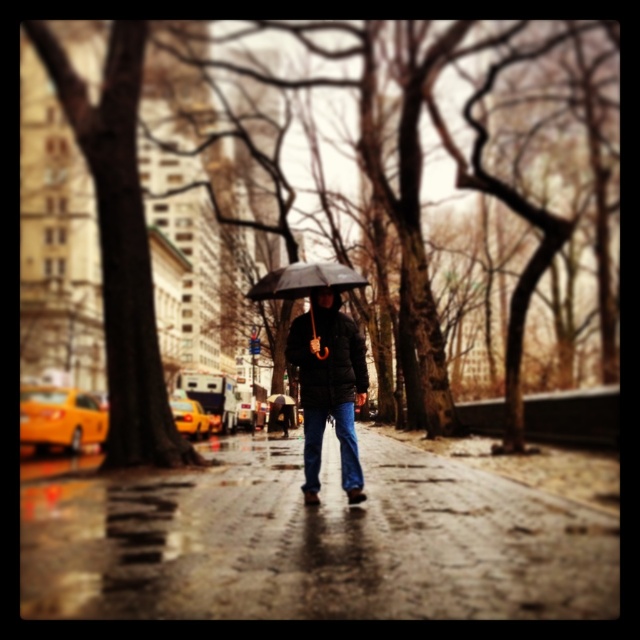
Which is behind, point (305, 442) or point (337, 284)?

The point (305, 442) is behind.

In the scene shown: Can you confirm if matte black jacket at center is positioned above black matte umbrella at center?

No, matte black jacket at center is not above black matte umbrella at center.

Find the location of `matte black jacket at center`. matte black jacket at center is located at coordinates (328, 387).

This screenshot has width=640, height=640. In order to click on matte black jacket at center in this screenshot , I will do `click(328, 387)`.

Between point (362, 600) and point (320, 268), which one is positioned in front?

Positioned in front is point (362, 600).

In the scene shown: Does wet asphalt sidewalk at center appear under black matte umbrella at center?

Yes.

Measure the distance between wet asphalt sidewalk at center and camera.

wet asphalt sidewalk at center is 12.75 feet away from camera.

At what (x,y) coordinates should I click in order to perform the action: click on wet asphalt sidewalk at center. Please return your answer as a coordinate pair (x, y). Looking at the image, I should click on (312, 541).

Between wet asphalt sidewalk at center and matte black jacket at center, which one has more height?

matte black jacket at center is taller.

Can you confirm if wet asphalt sidewalk at center is positioned to the left of matte black jacket at center?

In fact, wet asphalt sidewalk at center is to the right of matte black jacket at center.

Who is more distant from viewer, (x=144, y=524) or (x=305, y=326)?

Positioned behind is point (x=305, y=326).

This screenshot has height=640, width=640. What are the coordinates of `wet asphalt sidewalk at center` in the screenshot? It's located at (312, 541).